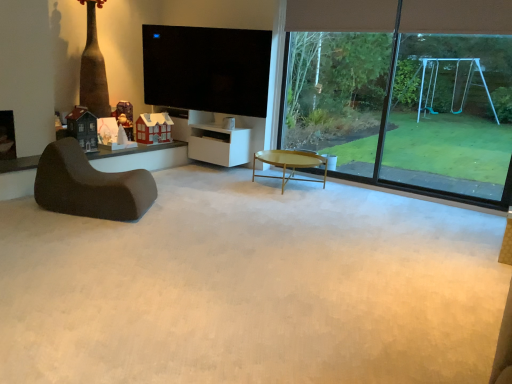
At what (x,y) coordinates should I click in order to perform the action: click on free space in front of dark brown fabric chair at left. Please return your answer as a coordinate pair (x, y). The width and height of the screenshot is (512, 384). Looking at the image, I should click on (73, 238).